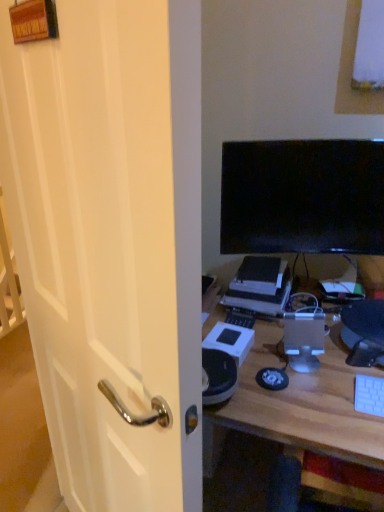
Question: From the image's perspective, is white plastic keyboard at lower right above black glossy screen at upper right?

Choices:
 (A) yes
 (B) no

Answer: (B)

Question: From a real-world perspective, is white plastic keyboard at lower right located higher than black glossy screen at upper right?

Choices:
 (A) no
 (B) yes

Answer: (A)

Question: Considering the relative positions of white plastic keyboard at lower right and black glossy screen at upper right in the image provided, is white plastic keyboard at lower right to the left of black glossy screen at upper right from the viewer's perspective?

Choices:
 (A) yes
 (B) no

Answer: (B)

Question: From a real-world perspective, is white plastic keyboard at lower right beneath black glossy screen at upper right?

Choices:
 (A) no
 (B) yes

Answer: (B)

Question: Can you confirm if white plastic keyboard at lower right is thinner than black glossy screen at upper right?

Choices:
 (A) yes
 (B) no

Answer: (B)

Question: Is white plastic keyboard at lower right closer to the viewer compared to black glossy screen at upper right?

Choices:
 (A) no
 (B) yes

Answer: (B)

Question: From the image's perspective, is white glossy door handle at left located above black glossy screen at upper right?

Choices:
 (A) no
 (B) yes

Answer: (A)

Question: Can you confirm if white glossy door handle at left is taller than black glossy screen at upper right?

Choices:
 (A) yes
 (B) no

Answer: (A)

Question: From a real-world perspective, is white glossy door handle at left positioned under black glossy screen at upper right based on gravity?

Choices:
 (A) no
 (B) yes

Answer: (B)

Question: Is white glossy door handle at left positioned far away from black glossy screen at upper right?

Choices:
 (A) no
 (B) yes

Answer: (A)

Question: Is white glossy door handle at left positioned behind black glossy screen at upper right?

Choices:
 (A) no
 (B) yes

Answer: (A)

Question: Considering the relative sizes of white glossy door handle at left and black glossy screen at upper right in the image provided, is white glossy door handle at left smaller than black glossy screen at upper right?

Choices:
 (A) no
 (B) yes

Answer: (A)

Question: From a real-world perspective, is white wood desk at center on top of satin silver computer tower at center?

Choices:
 (A) yes
 (B) no

Answer: (B)